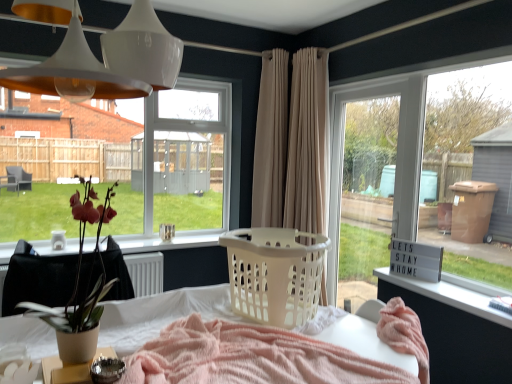
Question: Can you confirm if clear glass window at upper left is thinner than matte brown pot at left?

Choices:
 (A) yes
 (B) no

Answer: (A)

Question: Does clear glass window at upper left have a greater width compared to matte brown pot at left?

Choices:
 (A) no
 (B) yes

Answer: (A)

Question: Is clear glass window at upper left far away from matte brown pot at left?

Choices:
 (A) yes
 (B) no

Answer: (A)

Question: Is clear glass window at upper left in front of matte brown pot at left?

Choices:
 (A) no
 (B) yes

Answer: (A)

Question: Is clear glass window at upper left turned away from matte brown pot at left?

Choices:
 (A) no
 (B) yes

Answer: (A)

Question: In terms of size, does clear glass window at upper left appear bigger or smaller than beige fabric curtain at center, placed as the 1th curtain when sorted from left to right?

Choices:
 (A) small
 (B) big

Answer: (B)

Question: In terms of height, does clear glass window at upper left look taller or shorter compared to beige fabric curtain at center, placed as the 1th curtain when sorted from left to right?

Choices:
 (A) short
 (B) tall

Answer: (A)

Question: Is clear glass window at upper left to the left or to the right of beige fabric curtain at center, placed as the 1th curtain when sorted from left to right, in the image?

Choices:
 (A) right
 (B) left

Answer: (B)

Question: From the image's perspective, is clear glass window at upper left positioned above or below beige fabric curtain at center, the 2th curtain when ordered from right to left?

Choices:
 (A) below
 (B) above

Answer: (A)

Question: From the image's perspective, is white plastic laundry basket at center above or below beige fabric curtain at center, the 2th curtain when ordered from right to left?

Choices:
 (A) above
 (B) below

Answer: (B)

Question: Is white plastic laundry basket at center in front of or behind beige fabric curtain at center, placed as the 1th curtain when sorted from left to right, in the image?

Choices:
 (A) front
 (B) behind

Answer: (A)

Question: Is point (318, 266) closer or farther from the camera than point (275, 54)?

Choices:
 (A) farther
 (B) closer

Answer: (B)

Question: In terms of size, does white plastic laundry basket at center appear bigger or smaller than beige fabric curtain at center, placed as the 1th curtain when sorted from left to right?

Choices:
 (A) big
 (B) small

Answer: (B)

Question: In the image, is white glossy pendant lights at upper center on the left side or the right side of white plastic changing table at lower right?

Choices:
 (A) left
 (B) right

Answer: (A)

Question: Considering the positions of point (108, 71) and point (451, 352), is point (108, 71) closer or farther from the camera than point (451, 352)?

Choices:
 (A) closer
 (B) farther

Answer: (A)